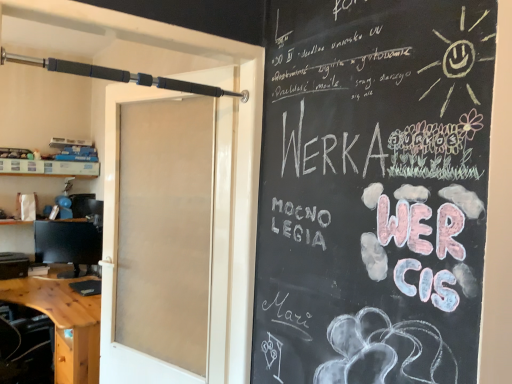
Identify the location of wooden desk at lower left. Image resolution: width=512 pixels, height=384 pixels. (64, 322).

Where is `black rubberized barbell at upper left`? This screenshot has height=384, width=512. black rubberized barbell at upper left is located at coordinates (121, 76).

Measure the distance between point (101, 236) and camera.

Point (101, 236) and camera are 3.22 meters apart.

Find the location of a particular element. This screenshot has height=384, width=512. white frosted glass door at center is located at coordinates (184, 244).

Does point (138, 141) come in front of point (53, 258)?

Yes.

Considering the relative sizes of white frosted glass door at center and matte black monitor at left in the image provided, is white frosted glass door at center taller than matte black monitor at left?

Yes, white frosted glass door at center is taller than matte black monitor at left.

Does white frosted glass door at center have a larger size compared to matte black monitor at left?

Indeed, white frosted glass door at center has a larger size compared to matte black monitor at left.

Is matte black monitor at left at the back of white frosted glass door at center?

That's not correct — white frosted glass door at center is not looking away from matte black monitor at left.

From the image's perspective, is black rubberized barbell at upper left located beneath white paper bag at left?

Incorrect, from the image's perspective, black rubberized barbell at upper left is higher than white paper bag at left.

Considering the sizes of objects black rubberized barbell at upper left and white paper bag at left in the image provided, who is wider, black rubberized barbell at upper left or white paper bag at left?

white paper bag at left.

Is white paper bag at left at the back of black rubberized barbell at upper left?

No, black rubberized barbell at upper left's orientation is not away from white paper bag at left.

Considering the positions of objects black rubberized barbell at upper left and white paper bag at left in the image provided, who is more to the right, black rubberized barbell at upper left or white paper bag at left?

black rubberized barbell at upper left.

Considering the relative sizes of matte black monitor at left and white frosted glass door at center in the image provided, is matte black monitor at left taller than white frosted glass door at center?

No, matte black monitor at left is not taller than white frosted glass door at center.

Is matte black monitor at left positioned with its back to white frosted glass door at center?

No, matte black monitor at left is not facing away from white frosted glass door at center.

Is matte black monitor at left bigger than white frosted glass door at center?

No.

Are matte black monitor at left and white frosted glass door at center located far from each other?

Yes, matte black monitor at left and white frosted glass door at center are located far from each other.

Is matte black monitor at left turned away from white paper bag at left?

No, matte black monitor at left's orientation is not away from white paper bag at left.

Is white paper bag at left completely or partially inside matte black monitor at left?

No, matte black monitor at left does not contain white paper bag at left.

What's the angular difference between matte black monitor at left and white paper bag at left's facing directions?

38.3 degrees.

From a real-world perspective, is matte black monitor at left positioned under white paper bag at left based on gravity?

Yes, from a real-world perspective, matte black monitor at left is under white paper bag at left.

Looking at this image, from a real-world perspective, is white frosted glass door at center positioned above or below black rubberized barbell at upper left?

Clearly, from a real-world perspective, white frosted glass door at center is below black rubberized barbell at upper left.

Is point (175, 344) farther from camera compared to point (189, 92)?

Yes, it is behind point (189, 92).

How much distance is there between white frosted glass door at center and black rubberized barbell at upper left?

25.21 inches.

Considering the relative sizes of white frosted glass door at center and black rubberized barbell at upper left in the image provided, is white frosted glass door at center shorter than black rubberized barbell at upper left?

No.

Looking at this image, which object is further away from the camera taking this photo, black rubberized barbell at upper left or wooden desk at lower left?

wooden desk at lower left is further away from the camera.

Identify the location of desk on the left of the black rubberized barbell at upper left. The height and width of the screenshot is (384, 512). (64, 322).

Can you tell me how much black rubberized barbell at upper left and wooden desk at lower left differ in facing direction?

They differ by 91.7 degrees in their facing directions.

Between matte black monitor at left and wooden desk at lower left, which one is positioned behind?

matte black monitor at left is further from the camera.

From a real-world perspective, is matte black monitor at left positioned over wooden desk at lower left based on gravity?

Indeed, from a real-world perspective, matte black monitor at left stands above wooden desk at lower left.

Is wooden desk at lower left a part of matte black monitor at left?

That's incorrect, wooden desk at lower left is not inside matte black monitor at left.

The width and height of the screenshot is (512, 384). Find the location of `door located above the matte black monitor at left (from a real-world perspective)`. door located above the matte black monitor at left (from a real-world perspective) is located at coordinates (184, 244).

Where is `fishing pole above the white paper bag at left (from the image's perspective)`? This screenshot has height=384, width=512. fishing pole above the white paper bag at left (from the image's perspective) is located at coordinates (121, 76).

When comparing their distances from matte black monitor at left, does white frosted glass door at center or wooden desk at lower left seem closer?

wooden desk at lower left is closer to matte black monitor at left.

In the scene shown: Looking at the image, which one is located closer to matte black monitor at left, white paper bag at left or black rubberized barbell at upper left?

white paper bag at left is positioned closer to the anchor matte black monitor at left.

Estimate the real-world distances between objects in this image. Which object is closer to wooden desk at lower left, black rubberized barbell at upper left or matte black monitor at left?

The object closer to wooden desk at lower left is matte black monitor at left.

Looking at the image, which one is located closer to white frosted glass door at center, matte black monitor at left or black rubberized barbell at upper left?

black rubberized barbell at upper left.

Which object lies nearer to the anchor point black rubberized barbell at upper left, matte black monitor at left or wooden desk at lower left?

matte black monitor at left is closer to black rubberized barbell at upper left.

Which object lies further to the anchor point black rubberized barbell at upper left, white frosted glass door at center or matte black monitor at left?

Based on the image, matte black monitor at left appears to be further to black rubberized barbell at upper left.

From the image, which object appears to be nearer to black rubberized barbell at upper left, white paper bag at left or white frosted glass door at center?

white frosted glass door at center is positioned closer to the anchor black rubberized barbell at upper left.

Considering their positions, is matte black monitor at left positioned closer to wooden desk at lower left than black rubberized barbell at upper left?

Based on the image, matte black monitor at left appears to be nearer to wooden desk at lower left.

Find the location of `shelf positioned between white frosted glass door at center and matte black monitor at left from near to far`. shelf positioned between white frosted glass door at center and matte black monitor at left from near to far is located at coordinates (29, 190).

This screenshot has width=512, height=384. In order to click on shelf between black rubberized barbell at upper left and matte black monitor at left from front to back in this screenshot , I will do `click(29, 190)`.

Image resolution: width=512 pixels, height=384 pixels. I want to click on door between black rubberized barbell at upper left and matte black monitor at left along the z-axis, so click(184, 244).

The image size is (512, 384). Find the location of `shelf between wooden desk at lower left and matte black monitor at left along the z-axis`. shelf between wooden desk at lower left and matte black monitor at left along the z-axis is located at coordinates (29, 190).